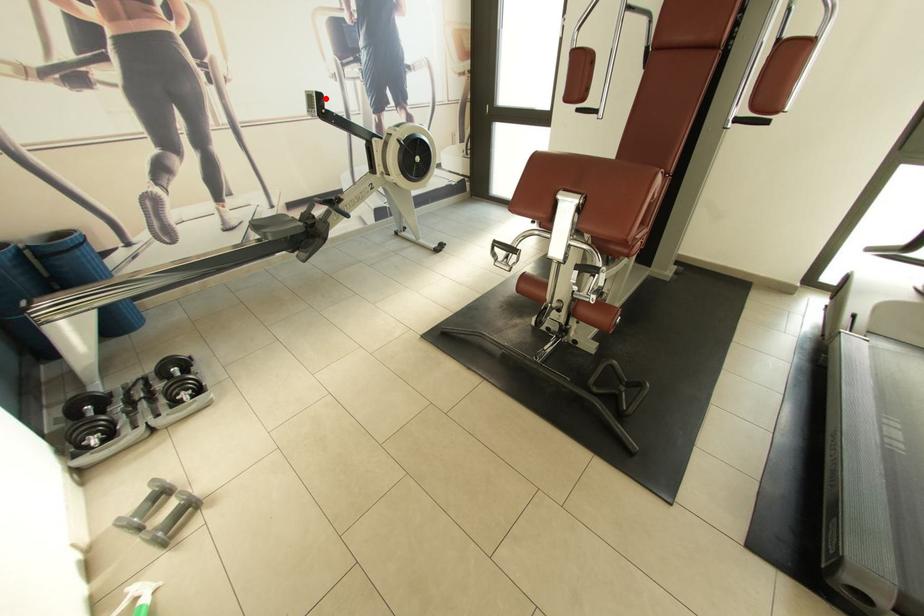
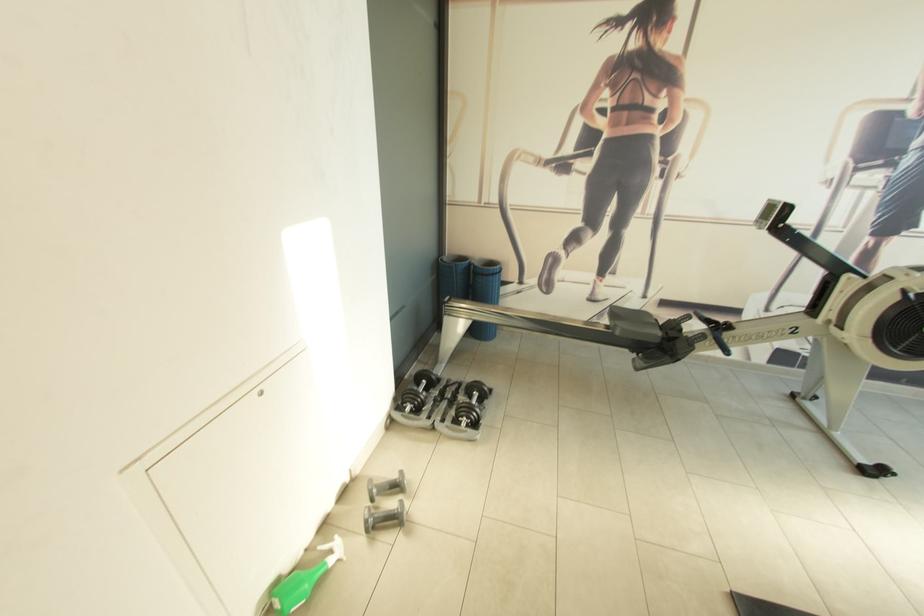
Question: I am providing you with two images of the same scene from different viewpoints. Image1 has a red point marked. In image2, the corresponding 3D location appears at what relative position? Reply with the corresponding letter.

Choices:
 (A) Closer
 (B) Farther

Answer: (B)